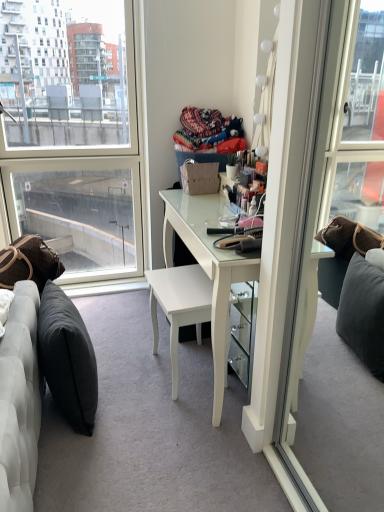
You are a GUI agent. You are given a task and a screenshot of the screen. Output one action in this format:
    pyautogui.click(x=<x>, y=<y>)
    Task: Click on the blank space to the left of white glossy chair at center
    The image size is (384, 512).
    Given the screenshot: What is the action you would take?
    pyautogui.click(x=122, y=372)